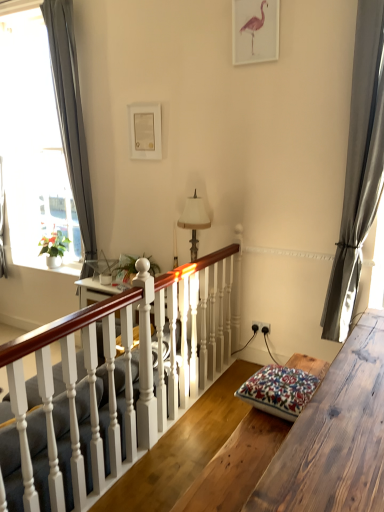
Question: Does matte pink flamingo at upper center, which is the 2th picture frame from back to front, have a lesser width compared to white painted wood at center?

Choices:
 (A) no
 (B) yes

Answer: (B)

Question: From a real-world perspective, is matte pink flamingo at upper center, marked as the 1th picture frame in a right-to-left arrangement, under white painted wood at center?

Choices:
 (A) no
 (B) yes

Answer: (A)

Question: Can you confirm if matte pink flamingo at upper center, arranged as the first picture frame when viewed from the front, is shorter than white painted wood at center?

Choices:
 (A) no
 (B) yes

Answer: (B)

Question: Is matte pink flamingo at upper center, which is the 2th picture frame from back to front, outside white painted wood at center?

Choices:
 (A) no
 (B) yes

Answer: (B)

Question: Is matte pink flamingo at upper center, arranged as the first picture frame when viewed from the front, far from white painted wood at center?

Choices:
 (A) yes
 (B) no

Answer: (A)

Question: Is matte pink flamingo at upper center, which is counted as the second picture frame, starting from the bottom, facing towards white painted wood at center?

Choices:
 (A) no
 (B) yes

Answer: (A)

Question: Can you confirm if white painted wood stairs at center is positioned to the left of satin gray curtain at right, which is the second curtain from left to right?

Choices:
 (A) yes
 (B) no

Answer: (A)

Question: Can you confirm if white painted wood stairs at center is bigger than satin gray curtain at right, which is the second curtain from left to right?

Choices:
 (A) no
 (B) yes

Answer: (B)

Question: Is white painted wood stairs at center looking in the opposite direction of satin gray curtain at right, the second curtain in the back-to-front sequence?

Choices:
 (A) yes
 (B) no

Answer: (B)

Question: Can you confirm if white painted wood stairs at center is taller than satin gray curtain at right, which is the second curtain from left to right?

Choices:
 (A) no
 (B) yes

Answer: (A)

Question: Is white painted wood stairs at center wider than satin gray curtain at right, which is counted as the first curtain, starting from the right?

Choices:
 (A) no
 (B) yes

Answer: (B)

Question: From a real-world perspective, is white painted wood stairs at center under satin gray curtain at right, which is counted as the first curtain, starting from the front?

Choices:
 (A) yes
 (B) no

Answer: (A)

Question: Considering the relative sizes of gray fabric curtain at left, arranged as the 1th curtain when viewed from the back, and black plastic power outlet at center-right in the image provided, is gray fabric curtain at left, arranged as the 1th curtain when viewed from the back, taller than black plastic power outlet at center-right?

Choices:
 (A) yes
 (B) no

Answer: (A)